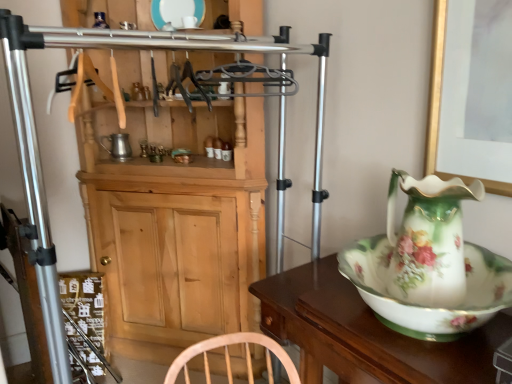
Question: From the image's perspective, would you say porcelain floral jug at right is positioned over wooden cabinet at center?

Choices:
 (A) yes
 (B) no

Answer: (B)

Question: Does porcelain floral jug at right appear on the right side of wooden cabinet at center?

Choices:
 (A) yes
 (B) no

Answer: (A)

Question: Are porcelain floral jug at right and wooden cabinet at center far apart?

Choices:
 (A) yes
 (B) no

Answer: (B)

Question: From the image's perspective, does porcelain floral jug at right appear lower than wooden cabinet at center?

Choices:
 (A) no
 (B) yes

Answer: (B)

Question: Is porcelain floral jug at right turned away from wooden cabinet at center?

Choices:
 (A) no
 (B) yes

Answer: (A)

Question: Is wooden cabinet at center completely or partially inside porcelain floral jug at right?

Choices:
 (A) no
 (B) yes

Answer: (A)

Question: Is wooden cabinet at center far away from white glossy bowl at right?

Choices:
 (A) no
 (B) yes

Answer: (A)

Question: From a real-world perspective, does wooden cabinet at center stand above white glossy bowl at right?

Choices:
 (A) yes
 (B) no

Answer: (A)

Question: Considering the relative sizes of wooden cabinet at center and white glossy bowl at right in the image provided, is wooden cabinet at center taller than white glossy bowl at right?

Choices:
 (A) no
 (B) yes

Answer: (B)

Question: Is wooden cabinet at center wider than white glossy bowl at right?

Choices:
 (A) no
 (B) yes

Answer: (A)

Question: Considering the relative sizes of wooden cabinet at center and white glossy bowl at right in the image provided, is wooden cabinet at center thinner than white glossy bowl at right?

Choices:
 (A) yes
 (B) no

Answer: (A)

Question: Can we say wooden cabinet at center lies outside white glossy bowl at right?

Choices:
 (A) no
 (B) yes

Answer: (B)

Question: Are porcelain plate at upper center and white glossy bowl at right beside each other?

Choices:
 (A) no
 (B) yes

Answer: (A)